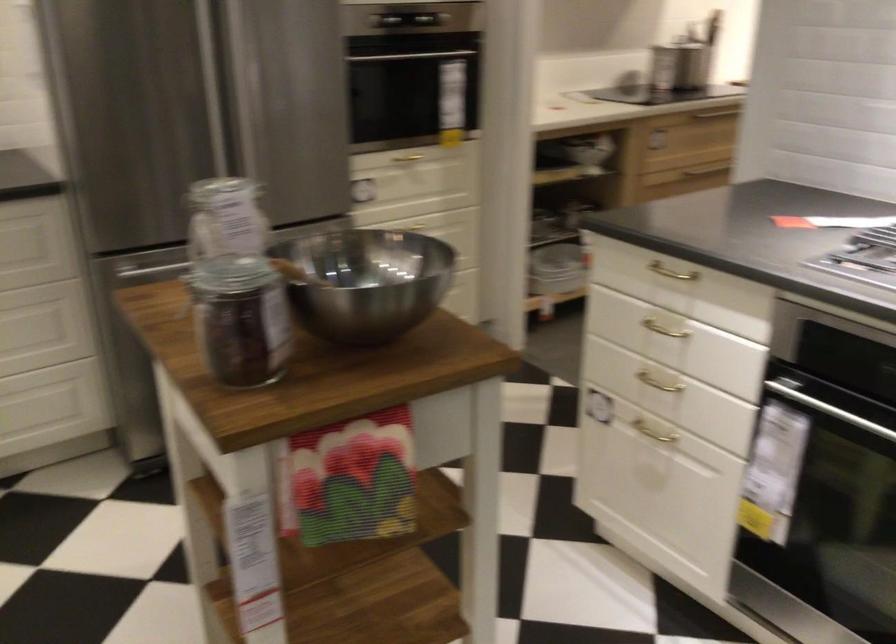
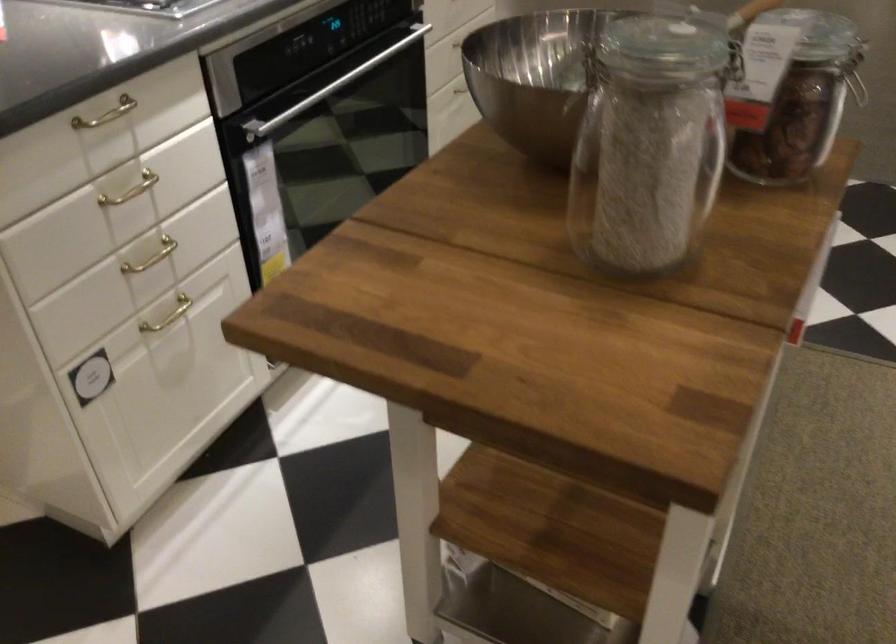
Locate, in the second image, the point that corresponds to (x=634, y=418) in the first image.

(168, 315)